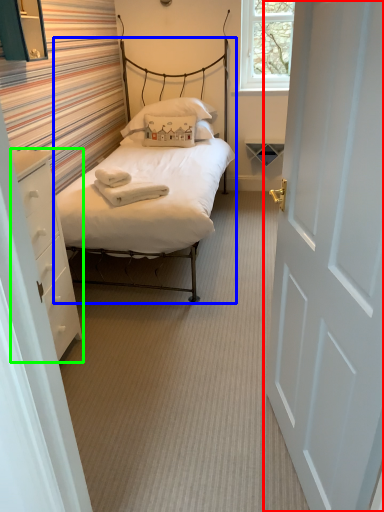
Question: Considering the real-world distances, which object is closest to door (highlighted by a red box)? bed (highlighted by a blue box) or nightstand (highlighted by a green box).

Choices:
 (A) bed
 (B) nightstand

Answer: (B)